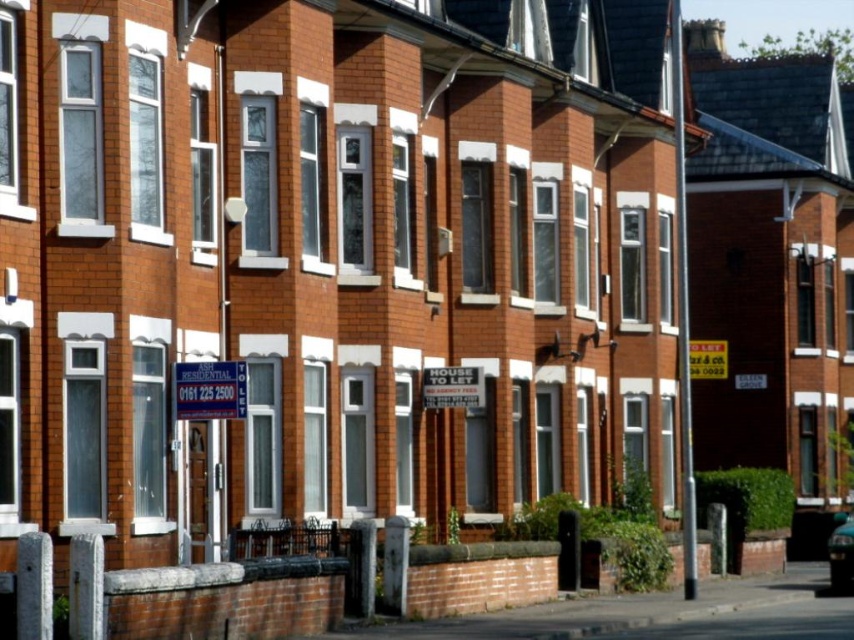
Is blue plastic sign at center behind metallic blue car at lower right?

No, it is in front of metallic blue car at lower right.

Is blue plastic sign at center shorter than metallic blue car at lower right?

Indeed, blue plastic sign at center has a lesser height compared to metallic blue car at lower right.

Which is in front, point (221, 403) or point (834, 570)?

Positioned in front is point (221, 403).

Locate an element on the screen. The image size is (854, 640). blue plastic sign at center is located at coordinates (209, 388).